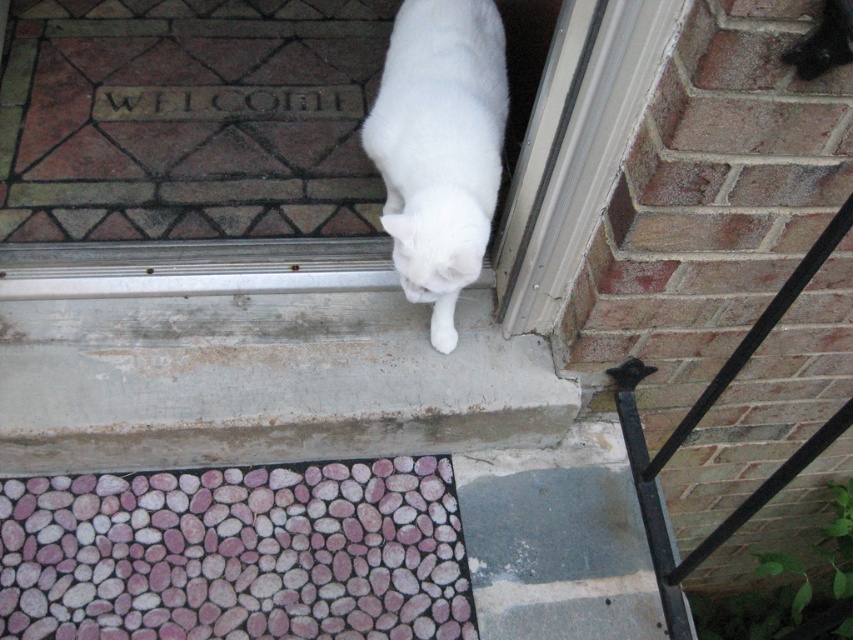
You are a delivery person trying to see if you can step over the black metal rail at right without bending down. The white fluffy cat at lower center is in your path. Since the cat is shorter than the rail, can you step over the rail while avoiding the cat?

The white fluffy cat at lower center has a lesser height compared to the black metal rail at right. Since the cat is shorter than the rail, you can step over the rail without bending down while avoiding the cat by stepping over it.